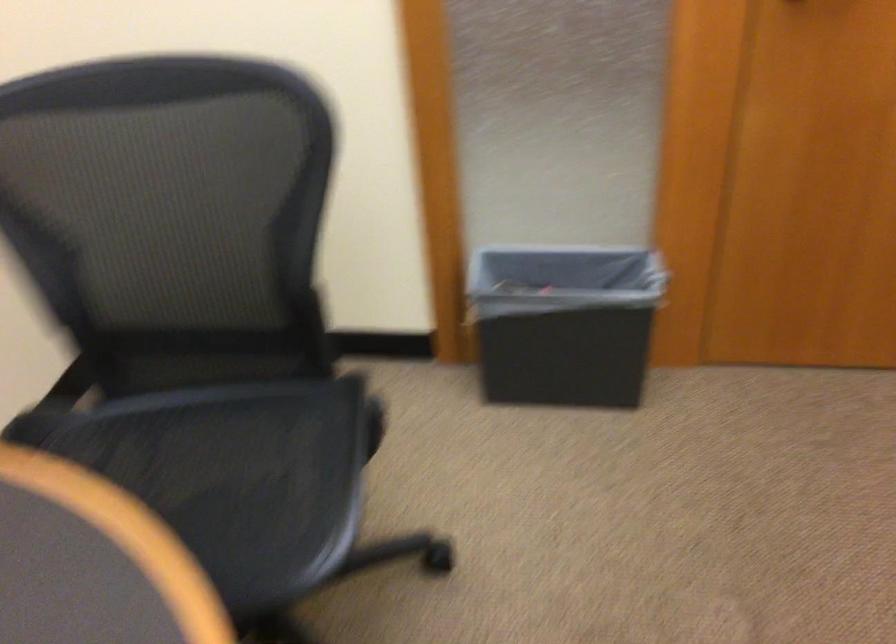
The width and height of the screenshot is (896, 644). What are the coordinates of `chair sitting surface` in the screenshot? It's located at (199, 500).